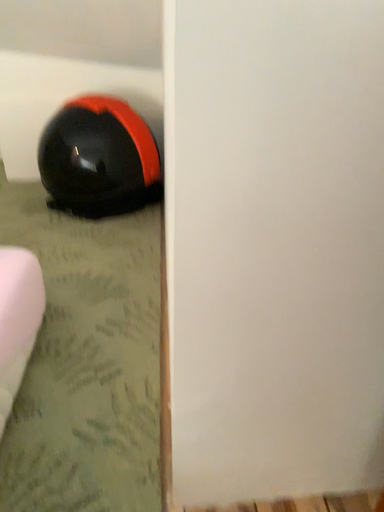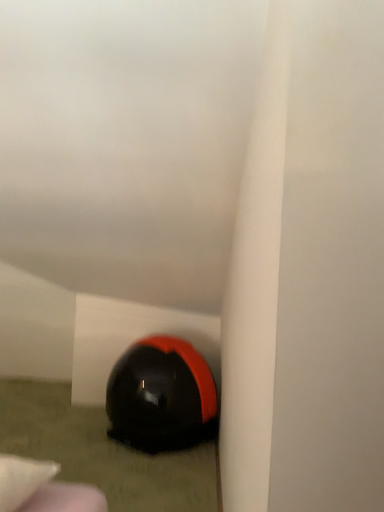
Question: Which way did the camera rotate in the video?

Choices:
 (A) rotated upward
 (B) rotated downward

Answer: (A)